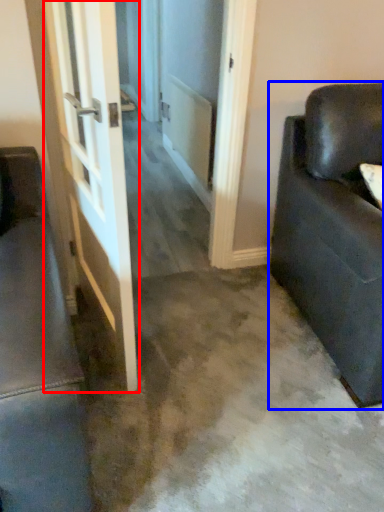
Question: Which object appears closest to the camera in this image, door (highlighted by a red box) or studio couch (highlighted by a blue box)?

Choices:
 (A) door
 (B) studio couch

Answer: (A)